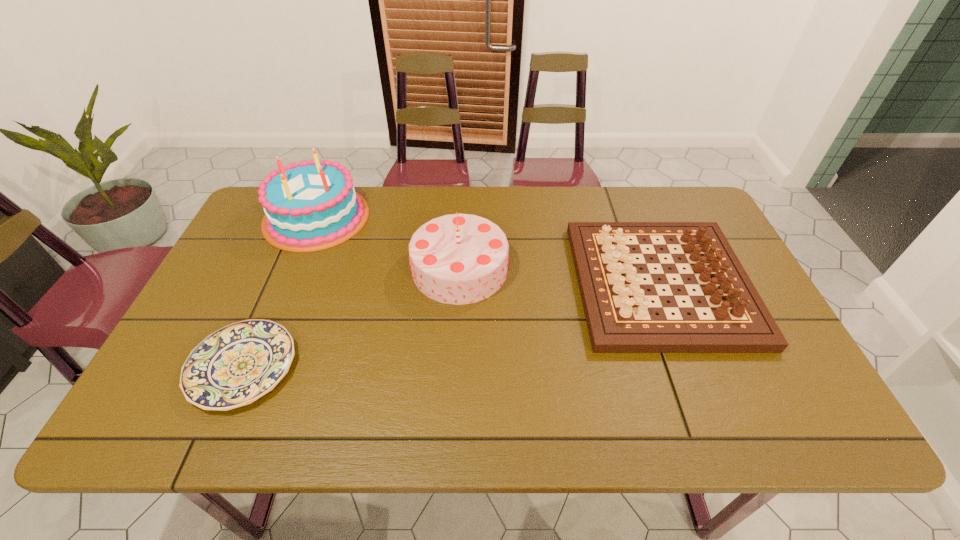
This screenshot has height=540, width=960. I want to click on vacant space situated on the right of the shortest object, so click(x=391, y=367).

Where is `birthday cake at the far edge`? birthday cake at the far edge is located at coordinates tap(309, 206).

Locate an element on the screen. gameboard that is at the far edge is located at coordinates (621, 318).

Locate an element on the screen. The image size is (960, 540). object present at the near edge is located at coordinates (234, 366).

Identify the location of birthday cake present at the left edge. (309, 206).

Find the location of a particular element. The height and width of the screenshot is (540, 960). plate that is at the left edge is located at coordinates point(234,366).

Locate an element on the screen. The height and width of the screenshot is (540, 960). object present at the right edge is located at coordinates (621, 318).

I want to click on object that is at the far left corner, so click(309, 206).

The width and height of the screenshot is (960, 540). In order to click on object that is positioned at the near left corner in this screenshot , I will do `click(234, 366)`.

The width and height of the screenshot is (960, 540). Find the location of `object that is at the far right corner`. object that is at the far right corner is located at coordinates (621, 318).